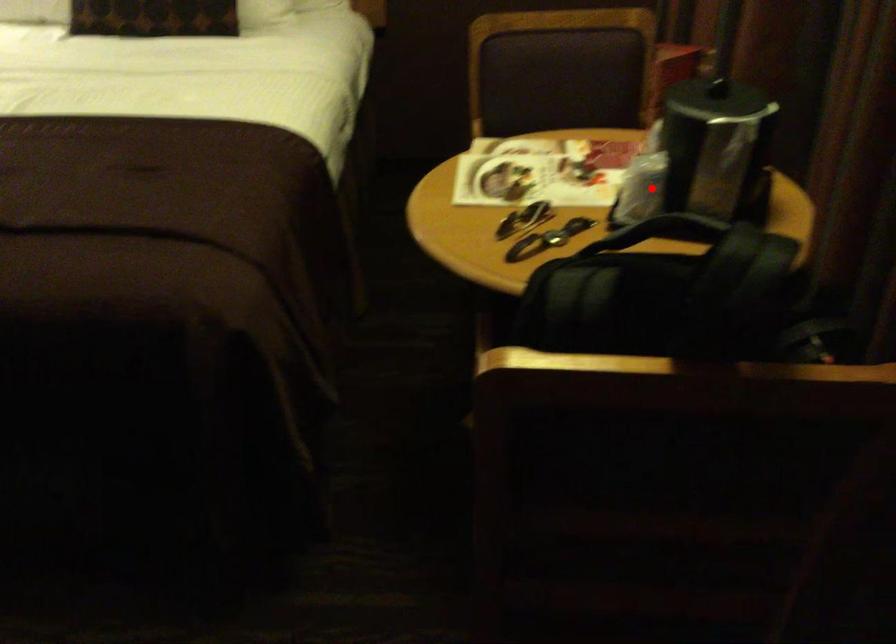
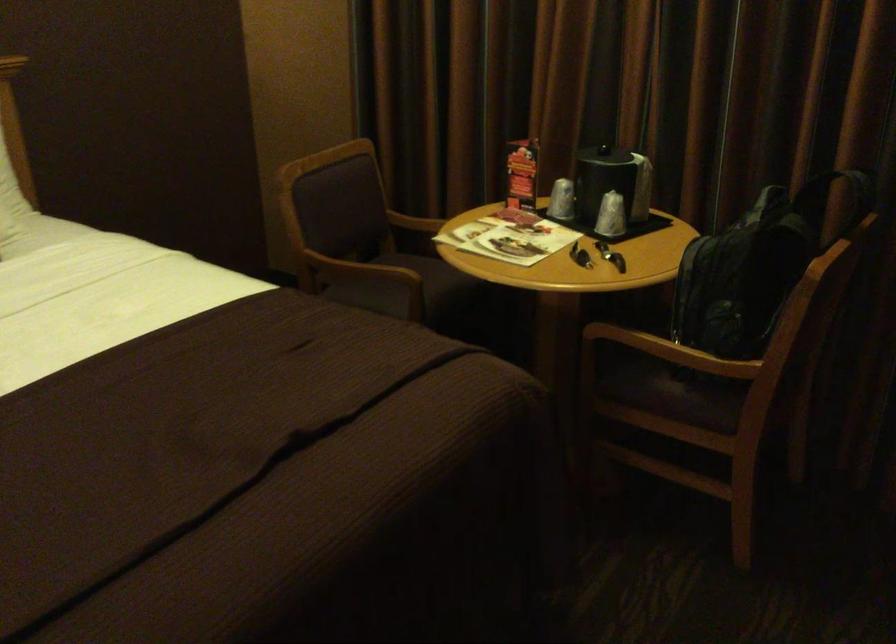
Where in the second image is the point corresponding to the highlighted location from the first image?

(610, 216)